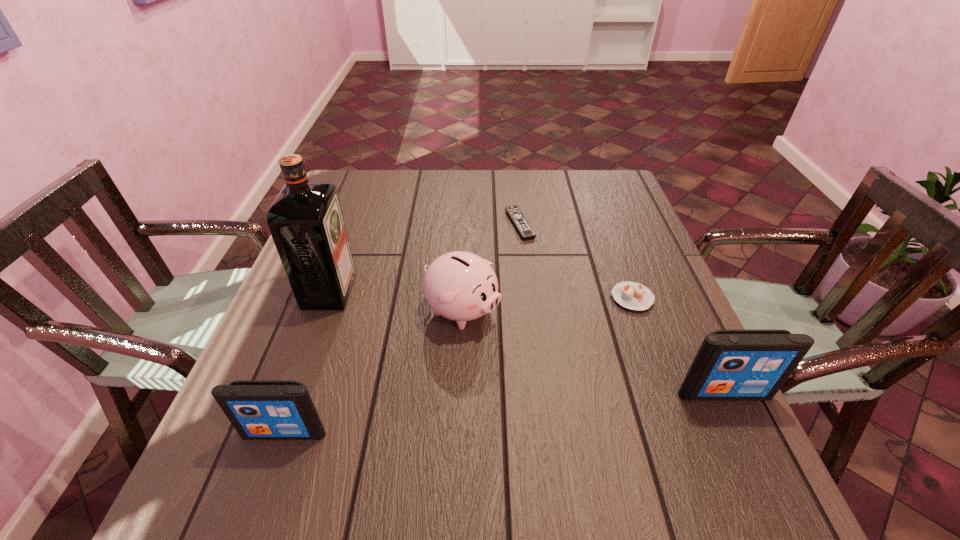
Please point a location where one more iPod can be added evenly. Please provide its 2D coordinates. Your answer should be formatted as a tuple, i.e. [(x, y)], where the tuple contains the x and y coordinates of a point satisfying the conditions above.

[(513, 412)]